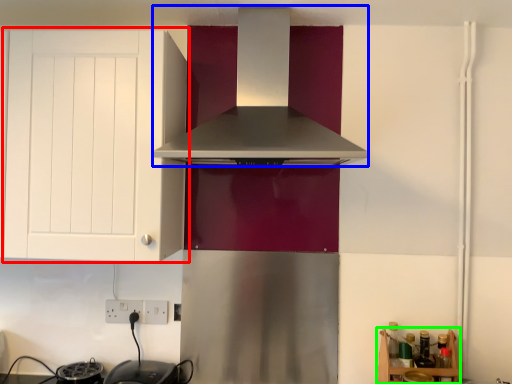
Question: Considering the real-world distances, which object is farthest from cabinetry (highlighted by a red box)? home appliance (highlighted by a blue box) or shelf (highlighted by a green box)?

Choices:
 (A) home appliance
 (B) shelf

Answer: (B)